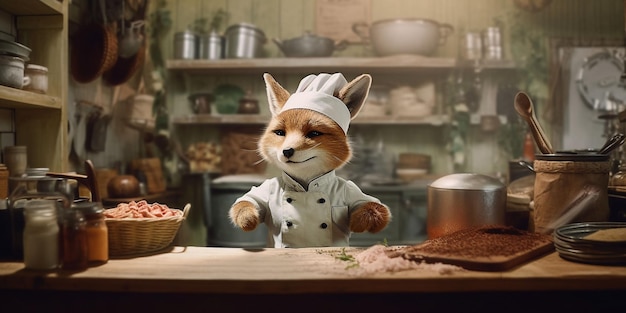
Identify the location of counter. The height and width of the screenshot is (313, 626). (274, 270).